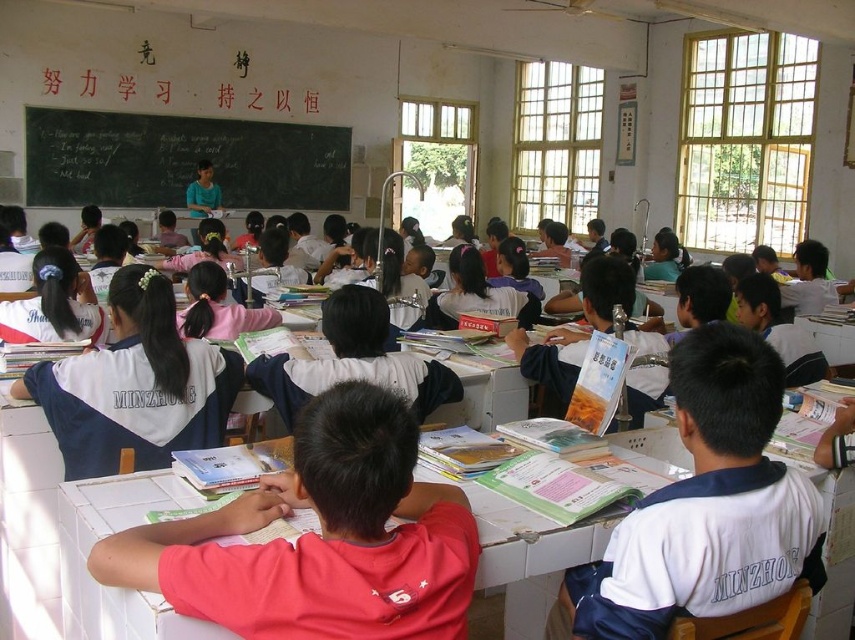
Question: Which point appears farthest from the camera in this image?

Choices:
 (A) (298, 131)
 (B) (376, 397)
 (C) (693, 554)
 (D) (587, 550)

Answer: (A)

Question: Is pink fabric shirt at center in front of black chalkboard at upper left?

Choices:
 (A) yes
 (B) no

Answer: (A)

Question: Where is pink fabric shirt at center located in relation to black chalkboard at upper left in the image?

Choices:
 (A) above
 (B) below

Answer: (B)

Question: Which of the following is the closest to the observer?

Choices:
 (A) white plastic table at center
 (B) black chalkboard at upper left
 (C) pink fabric shirt at center
 (D) white matte uniform at center

Answer: (C)

Question: Which object appears farthest from the camera in this image?

Choices:
 (A) white matte uniform at center
 (B) white plastic table at center

Answer: (A)

Question: Does black chalkboard at upper left have a greater width compared to white plastic table at center?

Choices:
 (A) no
 (B) yes

Answer: (B)